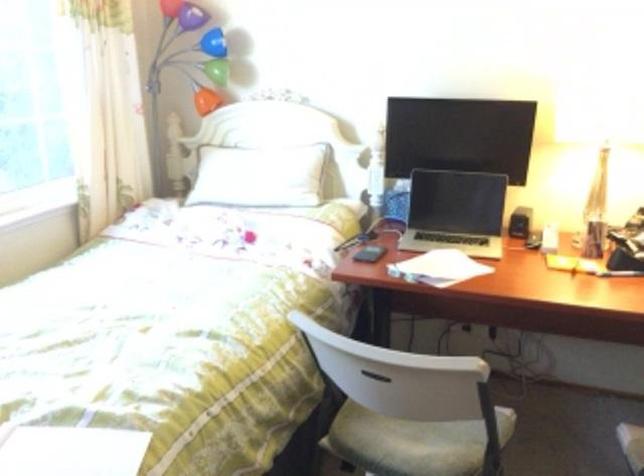
Image resolution: width=644 pixels, height=476 pixels. Describe the element at coordinates (213, 43) in the screenshot. I see `a blue lamp head` at that location.